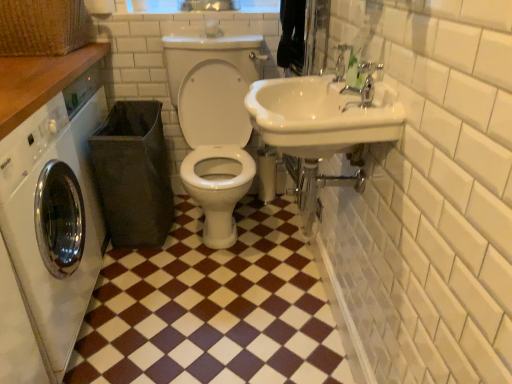
Measure the distance between point (89, 10) and camera.

6.85 feet.

The image size is (512, 384). Identify the location of white glossy sink at upper right. (323, 114).

Describe the element at coordinates (212, 308) in the screenshot. This screenshot has width=512, height=384. I see `brown glossy tile at lower left` at that location.

What is the approximate height of brown glossy tile at lower left?

The height of brown glossy tile at lower left is 1.33 inches.

Where is `white glossy toilet at center`? white glossy toilet at center is located at coordinates (214, 123).

Describe the element at coordinates (340, 61) in the screenshot. I see `silver metallic faucet at upper right` at that location.

Find the location of a particular element. The width and height of the screenshot is (512, 384). wooden counter at upper left is located at coordinates (40, 81).

Is the surface of white glossy sink at upper right in direct contact with burlap basket at upper left?

white glossy sink at upper right and burlap basket at upper left are not in contact.

Considering the sizes of white glossy sink at upper right and burlap basket at upper left in the image, is white glossy sink at upper right wider or thinner than burlap basket at upper left?

Result: Considering their sizes, white glossy sink at upper right looks slimmer than burlap basket at upper left.

Is the position of white glossy sink at upper right more distant than that of burlap basket at upper left?

No, white glossy sink at upper right is closer to the camera.

Measure the distance from white glossy sink at upper right to burlap basket at upper left.

white glossy sink at upper right is 1.17 meters from burlap basket at upper left.

Between brown glossy tile at lower left and white matte toilet paper at upper center, which one has larger size?

With larger size is brown glossy tile at lower left.

Which object is closer to the camera taking this photo, brown glossy tile at lower left or white matte toilet paper at upper center?

brown glossy tile at lower left.

Which is more to the right, brown glossy tile at lower left or white matte toilet paper at upper center?

brown glossy tile at lower left is more to the right.

Is brown glossy tile at lower left looking in the opposite direction of white matte toilet paper at upper center?

brown glossy tile at lower left is not turned away from white matte toilet paper at upper center.

Who is smaller, silver metallic faucet at upper right or wooden counter at upper left?

Smaller between the two is silver metallic faucet at upper right.

Is point (357, 90) closer or farther from the camera than point (64, 60)?

Point (357, 90) is closer to the camera than point (64, 60).

Considering the relative positions of silver metallic faucet at upper right and wooden counter at upper left in the image provided, is silver metallic faucet at upper right behind wooden counter at upper left?

Yes, silver metallic faucet at upper right is behind wooden counter at upper left.

Is wooden counter at upper left at the back of silver metallic faucet at upper right?

No, silver metallic faucet at upper right's orientation is not away from wooden counter at upper left.

You are a GUI agent. You are given a task and a screenshot of the screen. Output one action in this format:
    pyautogui.click(x=<x>, y=<y>)
    Task: Click on the toilet paper behind the burlap basket at upper left
    This screenshot has width=512, height=384.
    Given the screenshot: What is the action you would take?
    pyautogui.click(x=100, y=7)

Consider the image. From a real-world perspective, which object rests below the other?

From a 3D spatial view, burlap basket at upper left is below.

Which is more to the left, white matte toilet paper at upper center or burlap basket at upper left?

burlap basket at upper left is more to the left.

Could you tell me if white matte toilet paper at upper center is turned towards burlap basket at upper left?

Yes, white matte toilet paper at upper center is oriented towards burlap basket at upper left.

Is the surface of burlap basket at upper left in direct contact with silver metallic faucet at upper right?

burlap basket at upper left and silver metallic faucet at upper right are not in contact.

Does burlap basket at upper left turn towards silver metallic faucet at upper right?

No, burlap basket at upper left is not aimed at silver metallic faucet at upper right.

Would you say burlap basket at upper left is outside silver metallic faucet at upper right?

burlap basket at upper left is positioned outside silver metallic faucet at upper right.

Is point (298, 299) positioned before point (375, 125)?

No, (298, 299) is further to viewer.

Can white glossy sink at upper right be found inside brown glossy tile at lower left?

No, brown glossy tile at lower left does not contain white glossy sink at upper right.

Identify the location of ceramic tile that appears below the white glossy sink at upper right (from the image's perspective). (212, 308).

Is silver metallic faucet at upper right touching white glossy toilet at center?

No, silver metallic faucet at upper right is not making contact with white glossy toilet at center.

From the picture: Measure the distance from silver metallic faucet at upper right to white glossy toilet at center.

They are 30.43 inches apart.

Between silver metallic faucet at upper right and white glossy toilet at center, which one appears on the right side from the viewer's perspective?

silver metallic faucet at upper right.

Considering their positions, is silver metallic faucet at upper right located in front of or behind white glossy toilet at center?

Visually, silver metallic faucet at upper right is located in front of white glossy toilet at center.

Locate an element on the screen. basket to the left of white glossy sink at upper right is located at coordinates (42, 27).

Locate an element on the screen. The height and width of the screenshot is (384, 512). ceramic tile that is in front of the white matte toilet paper at upper center is located at coordinates (212, 308).

Considering their positions, is white glossy washing machine at left positioned further to white glossy sink at upper right than burlap basket at upper left?

Based on the image, burlap basket at upper left appears to be further to white glossy sink at upper right.

Considering their positions, is wooden counter at upper left positioned closer to white glossy toilet at center than burlap basket at upper left?

wooden counter at upper left is positioned closer to the anchor white glossy toilet at center.

Estimate the real-world distances between objects in this image. Which object is closer to brown glossy tile at lower left, white matte toilet paper at upper center or silver metallic faucet at upper right?

silver metallic faucet at upper right lies closer to brown glossy tile at lower left than the other object.

Considering their positions, is silver metallic faucet at upper right positioned further to white glossy sink at upper right than wooden counter at upper left?

Among the two, wooden counter at upper left is located further to white glossy sink at upper right.

Considering their positions, is silver metallic faucet at upper right positioned closer to brown glossy tile at lower left than burlap basket at upper left?

Among the two, silver metallic faucet at upper right is located nearer to brown glossy tile at lower left.

Considering their positions, is wooden counter at upper left positioned further to brown glossy tile at lower left than burlap basket at upper left?

burlap basket at upper left lies further to brown glossy tile at lower left than the other object.

Which object lies nearer to the anchor point white glossy washing machine at left, burlap basket at upper left or brown glossy tile at lower left?

brown glossy tile at lower left is positioned closer to the anchor white glossy washing machine at left.

Which object lies further to the anchor point silver metallic faucet at upper right, wooden counter at upper left or white glossy washing machine at left?

Based on the image, white glossy washing machine at left appears to be further to silver metallic faucet at upper right.

Image resolution: width=512 pixels, height=384 pixels. Identify the location of ceramic tile between white glossy washing machine at left and white glossy sink at upper right in the horizontal direction. (212, 308).

In order to click on sink between silver metallic faucet at upper right and brown glossy tile at lower left in the up-down direction in this screenshot , I will do `click(323, 114)`.

Find the location of `basket between white matte toilet paper at upper center and white glossy washing machine at left in the vertical direction`. basket between white matte toilet paper at upper center and white glossy washing machine at left in the vertical direction is located at coordinates (42, 27).

Locate an element on the screen. This screenshot has height=384, width=512. squat between white glossy washing machine at left and white glossy sink at upper right is located at coordinates (214, 123).